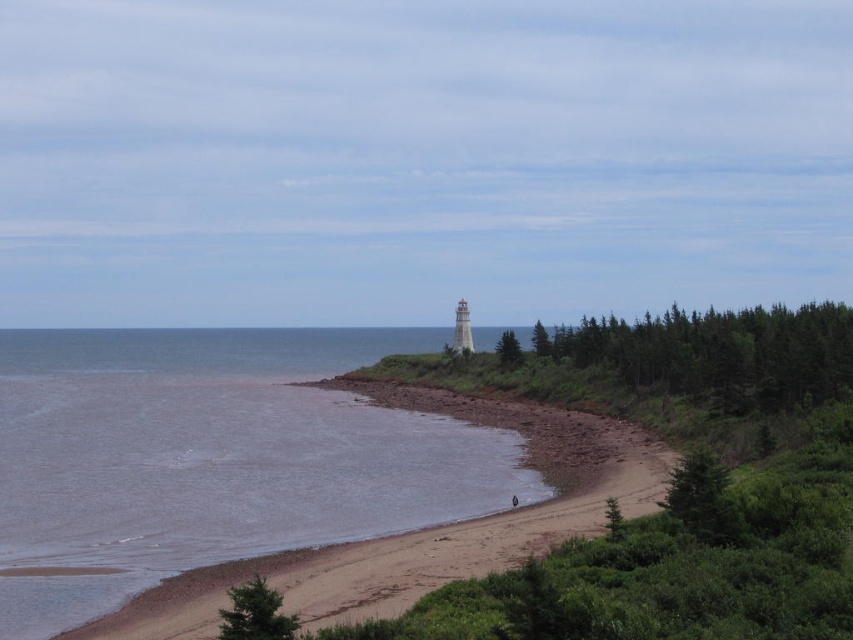
You are standing on the beach and see the green matte tree at lower left and the dark blue fabric at lower center. Which object is closer to the water?

The dark blue fabric at lower center is closer to the water because the green matte tree at lower left is to the left of it, meaning the dark blue fabric is positioned between the tree and the water.

You are standing on the beach looking towards the lighthouse. There are two points marked in the image. The first point is at coordinate point (32, 536) and the second is at point (685, 486). Which of these two points is closer to you?

Point (32, 536) is closer to you because it is further to the camera than point (685, 486).